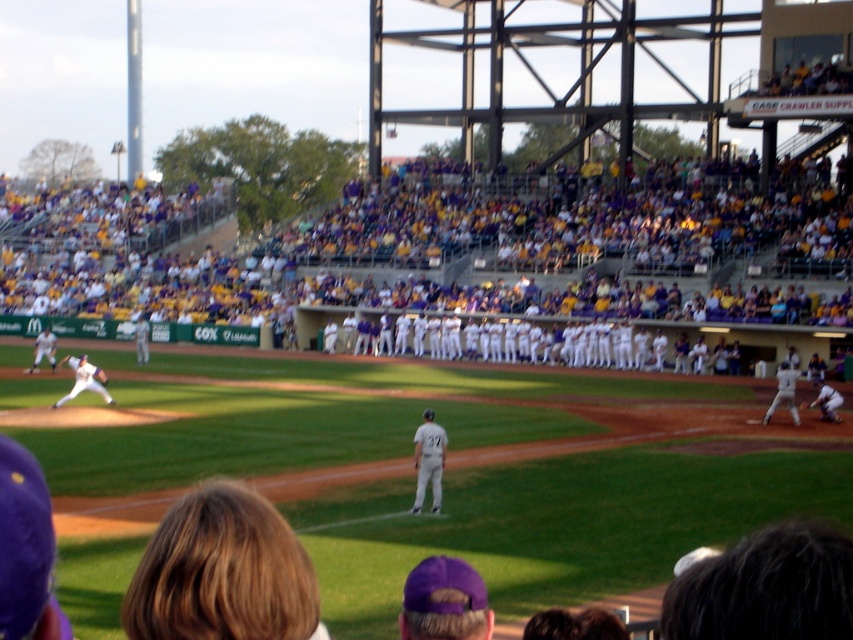
You are a photographer standing at the edge of the field. You want to take a photo that includes both the white uniform at center and the white uniform at right. Based on their positions, which one should you adjust your camera to focus on first to ensure both are in frame?

The white uniform at center is positioned on the left side of white uniform at right, so you should focus on the white uniform at right first to ensure both are captured in the frame.

You are a photographer standing at the center of the field. You want to take a photo of the white uniform at right. Which direction should you move to get the best shot?

The white uniform at right is located at point 0.627 on the x axis and 0.968 on the y axis. To get the best shot, move towards the right and slightly forward to align with the white uniform at right.